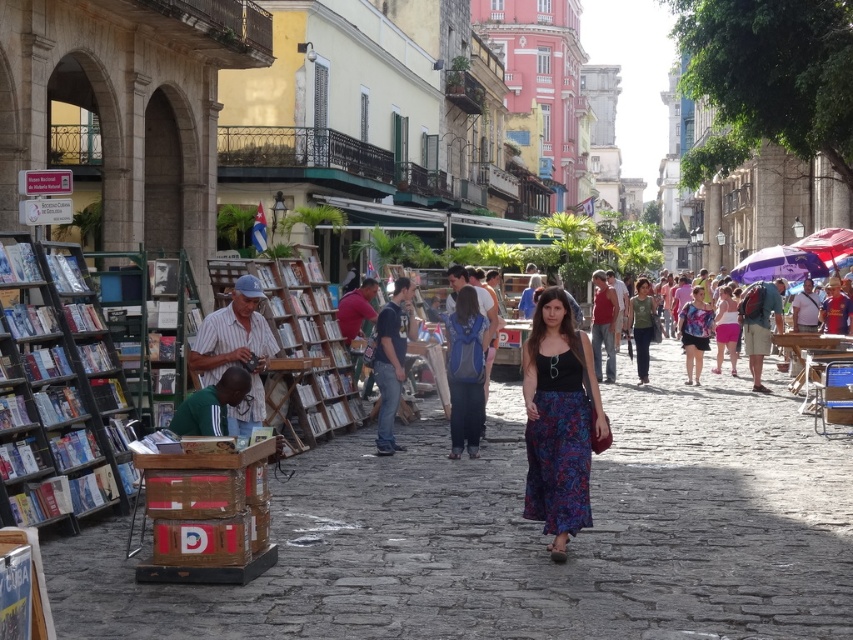
You are a customer in the street market and want to buy a book and a souvenir. You see the wooden bookshelf at center and the striped fabric vendor at center. Which one is shorter?

The wooden bookshelf at center is shorter than the striped fabric vendor at center.

You are a photographer standing in the street scene and want to capture both the floral dress at center and the pink fabric skirt at center in a single photo. Which one should you focus on first to ensure both are in the frame?

The floral dress at center is located above the pink fabric skirt at center, so you should focus on the pink fabric skirt at center first to ensure both are in the frame.